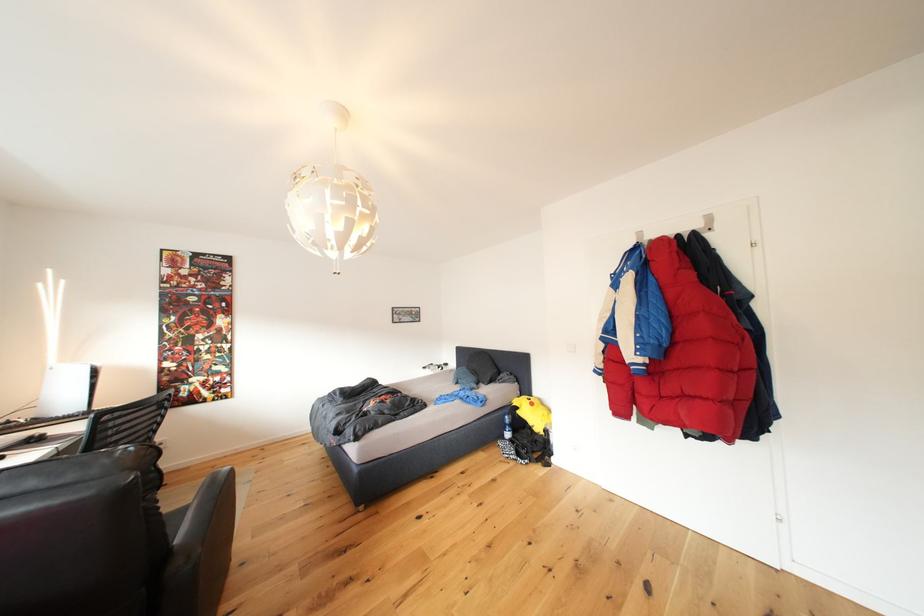
What do you see at coordinates (569, 345) in the screenshot? The image size is (924, 616). I see `a white light switch` at bounding box center [569, 345].